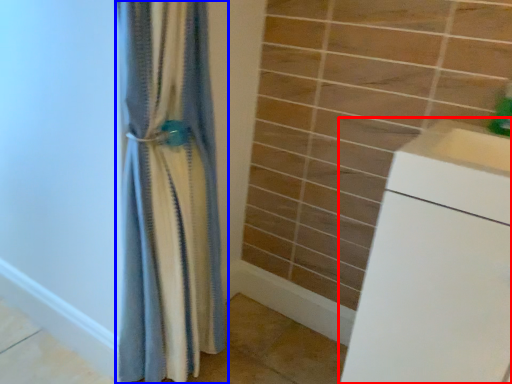
Question: Which of the following is the farthest to the observer, counter (highlighted by a red box) or curtain (highlighted by a blue box)?

Choices:
 (A) counter
 (B) curtain

Answer: (B)